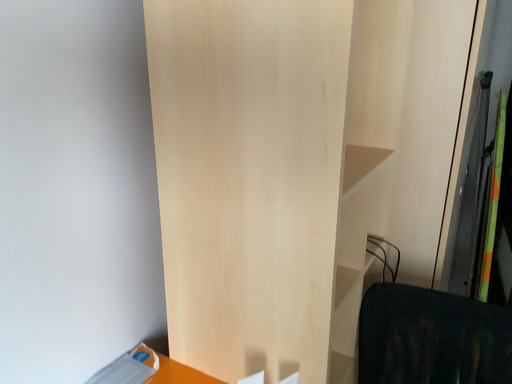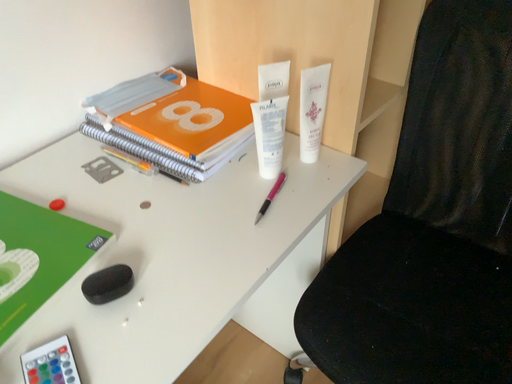
Question: Which way did the camera rotate in the video?

Choices:
 (A) rotated upward
 (B) rotated downward

Answer: (B)